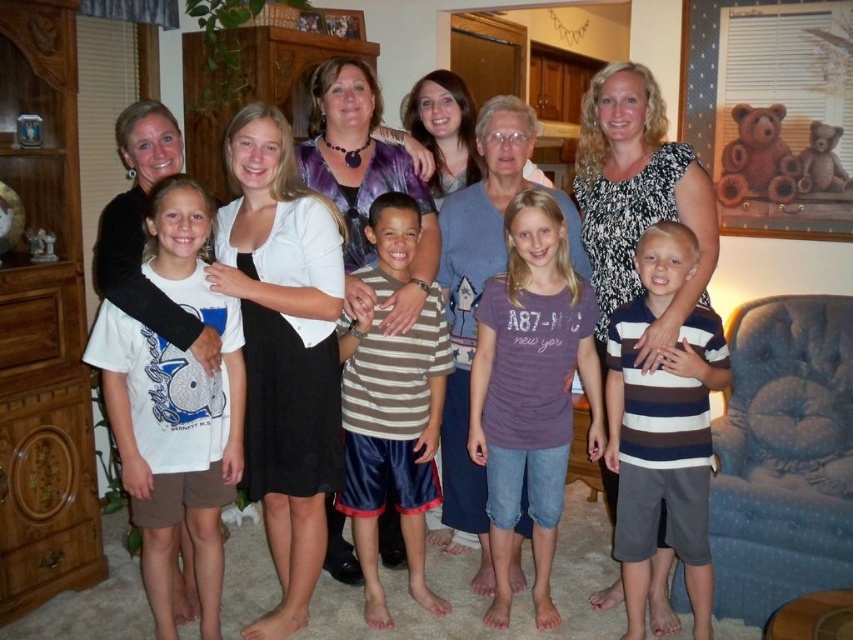
Is striped fabric shorts at center further to camera compared to purple tie-dye shirt at center?

No, striped fabric shorts at center is in front of purple tie-dye shirt at center.

Is striped fabric shorts at center positioned before purple tie-dye shirt at center?

Yes, it is.

Looking at this image, who is more distant from viewer, (389, 196) or (386, 305)?

Point (389, 196)

Identify the location of striped fabric shorts at center. This screenshot has height=640, width=853. (392, 442).

Between purple cotton shirt at center and striped fabric shorts at center, which one appears on the left side from the viewer's perspective?

From the viewer's perspective, striped fabric shorts at center appears more on the left side.

Who is higher up, purple cotton shirt at center or striped fabric shorts at center?

purple cotton shirt at center is higher up.

Locate an element on the screen. purple cotton shirt at center is located at coordinates (531, 388).

Can you confirm if white matte cardigan at center is positioned to the left of white cotton shirt at center?

Indeed, white matte cardigan at center is positioned on the left side of white cotton shirt at center.

Does white matte cardigan at center have a lesser width compared to white cotton shirt at center?

Yes.

What do you see at coordinates (283, 348) in the screenshot?
I see `white matte cardigan at center` at bounding box center [283, 348].

Find the location of a particular element. The height and width of the screenshot is (640, 853). white matte cardigan at center is located at coordinates (283, 348).